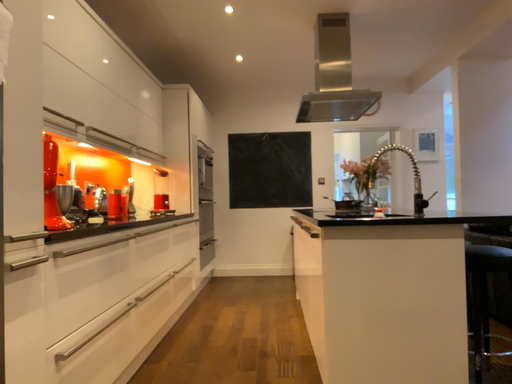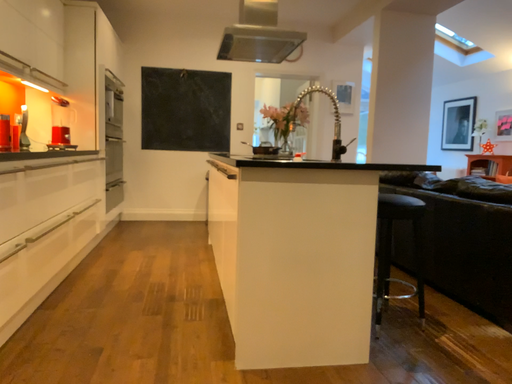
Question: Which way did the camera rotate in the video?

Choices:
 (A) rotated right
 (B) rotated left

Answer: (A)